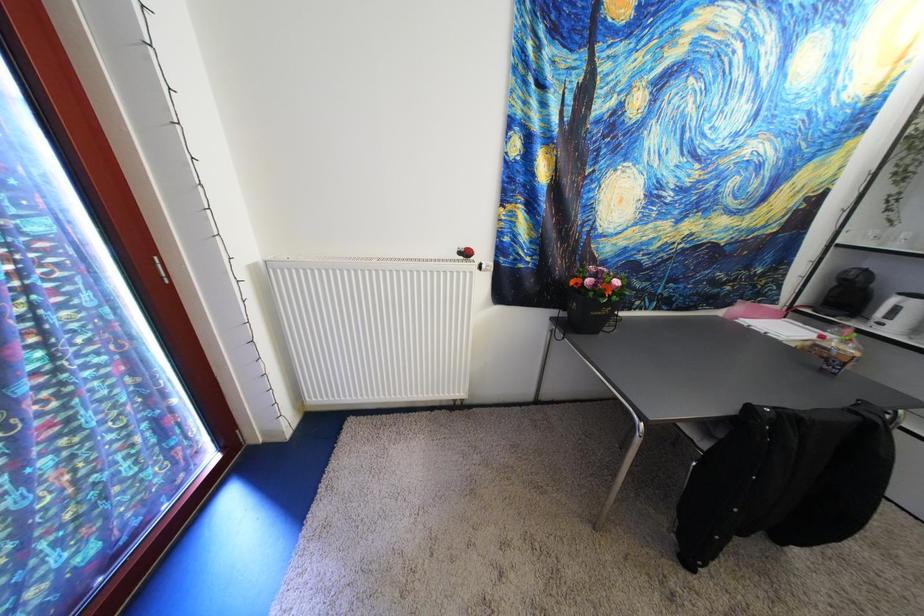
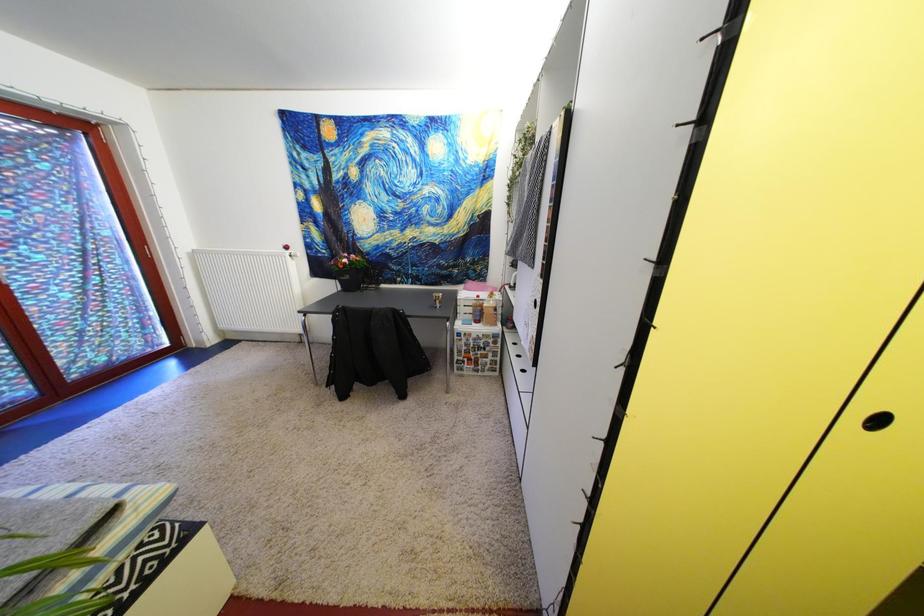
The images are taken continuously from a first-person perspective. In which direction are you moving?

The cameraman moved toward right, backward.